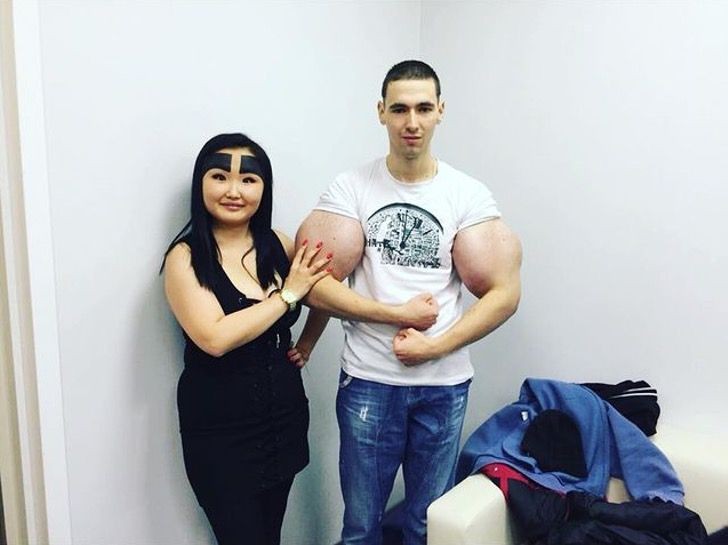
Locate an element on the screen. tan chair is located at coordinates (467, 508).